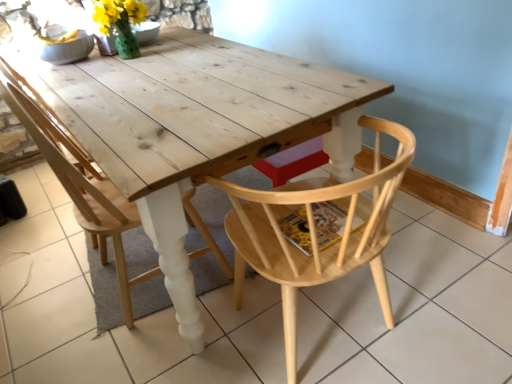
You are a GUI agent. You are given a task and a screenshot of the screen. Output one action in this format:
    pyautogui.click(x=<x>, y=<y>)
    Task: Click on the free spot below natural wood chair at center, the 2th chair positioned from the left (from a real-world perspective)
    This screenshot has width=512, height=384.
    Given the screenshot: What is the action you would take?
    pyautogui.click(x=335, y=330)